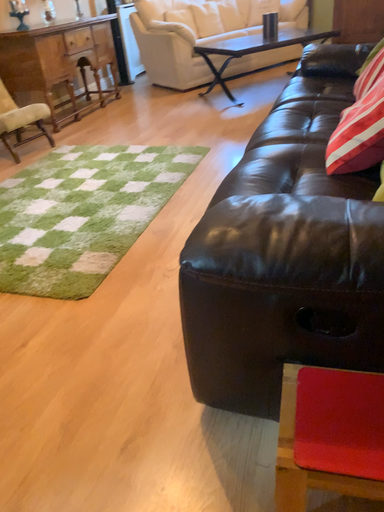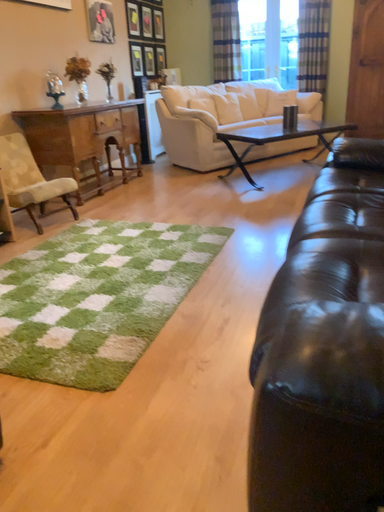
Question: Which way did the camera rotate in the video?

Choices:
 (A) rotated upward
 (B) rotated downward

Answer: (A)